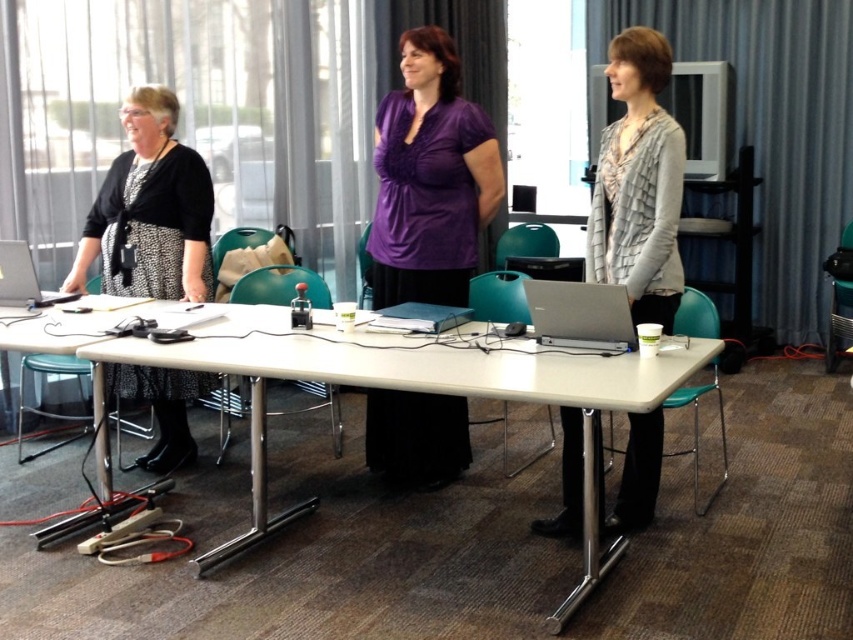
Question: Can you confirm if white plastic table at center is thinner than silver metallic laptop at center?

Choices:
 (A) yes
 (B) no

Answer: (B)

Question: Which of the following is the farthest from the observer?

Choices:
 (A) silver metallic laptop at center
 (B) black dotted dress at left

Answer: (B)

Question: Which of the following is the farthest from the observer?

Choices:
 (A) (569, 307)
 (B) (496, 342)
 (C) (196, 196)

Answer: (C)

Question: Can you confirm if silver metallic laptop at center is bigger than matte black laptop at center?

Choices:
 (A) no
 (B) yes

Answer: (B)

Question: Is white plastic table at center closer to the viewer compared to silver metallic laptop at center?

Choices:
 (A) yes
 (B) no

Answer: (A)

Question: Which point is farther from the camera taking this photo?

Choices:
 (A) (395, 316)
 (B) (547, 316)
 (C) (144, 188)
 (D) (567, 444)

Answer: (C)